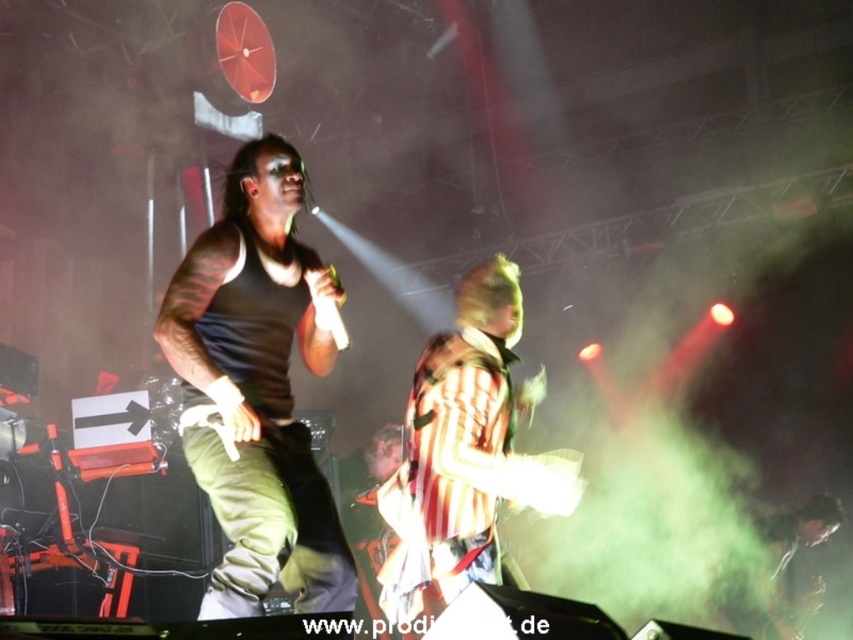
You are a photographer at the back of the venue. You want to capture a photo of both the black matte tank top at center and the striped shirt at center in the same frame. Which one will appear larger in the photo?

The black matte tank top at center will appear larger in the photo because it is taller than the striped shirt at center.

You are a photographer trying to capture the performer in the center. The point that represents the black matte tank top at center is at coordinate point [257,388]. If you want to focus on the black matte tank top at center, should you adjust your camera to the left or right of the current position?

The point representing the black matte tank top at center is already at the center coordinates, so no adjustment is needed. Keep the camera focused on the center point.

You are a photographer positioned at the origin point of the coordinate system. You want to capture a closeup shot of the black matte tank top at center. What are the coordinates you should aim your camera at?

The coordinates you should aim your camera at are point (257, 388).